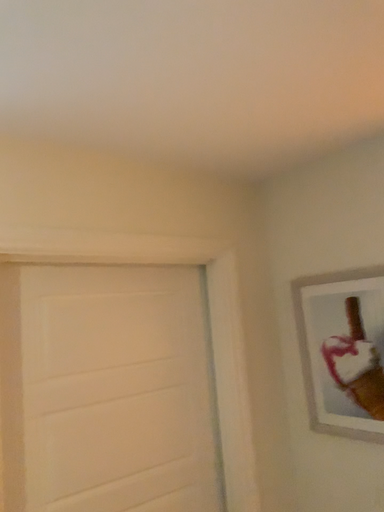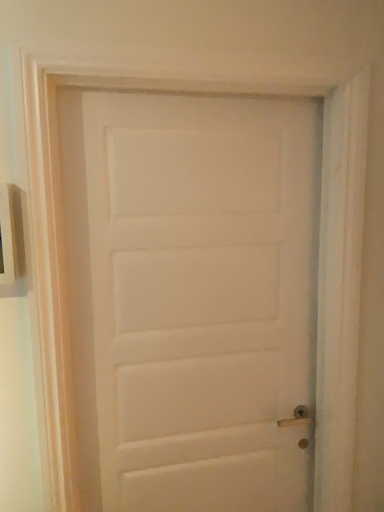
Question: Which way did the camera rotate in the video?

Choices:
 (A) rotated left
 (B) rotated right

Answer: (A)